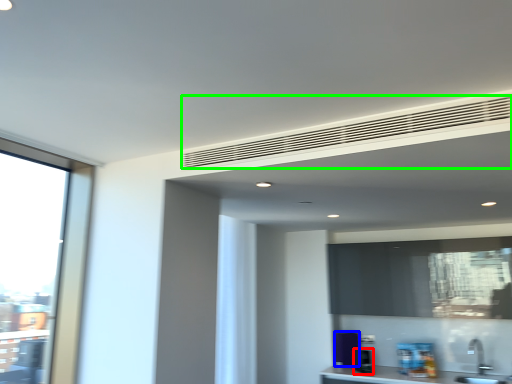
Question: Which object is the farthest from appliance (highlighted by a red box)? Choose among these: appliance (highlighted by a blue box) or blind (highlighted by a green box).

Choices:
 (A) appliance
 (B) blind

Answer: (B)